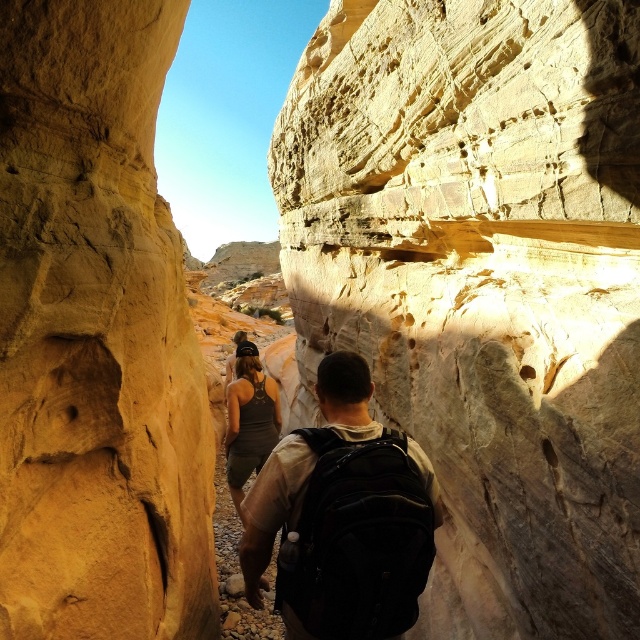
Is point (413, 3) positioned behind point (394, 429)?

Yes, point (413, 3) is behind point (394, 429).

Does matte sandstone rock face at center have a smaller size compared to matte black backpack at center?

No.

This screenshot has height=640, width=640. In order to click on matte sandstone rock face at center in this screenshot , I will do pyautogui.click(x=483, y=284).

Locate an element on the screen. matte sandstone rock face at center is located at coordinates (483, 284).

Is the position of matte yellow rock at left more distant than that of matte black backpack at center?

No, matte yellow rock at left is in front of matte black backpack at center.

Consider the image. Can you confirm if matte yellow rock at left is shorter than matte black backpack at center?

No, matte yellow rock at left is not shorter than matte black backpack at center.

Is point (188, 582) behind point (321, 502)?

Yes, it is.

Where is `matte yellow rock at left`? This screenshot has width=640, height=640. matte yellow rock at left is located at coordinates (96, 337).

Is point (301, 188) less distant than point (100, 259)?

No, it is behind (100, 259).

Who is more forward, (566, 576) or (42, 596)?

Point (42, 596) is more forward.

The width and height of the screenshot is (640, 640). I want to click on matte sandstone rock face at center, so click(x=483, y=284).